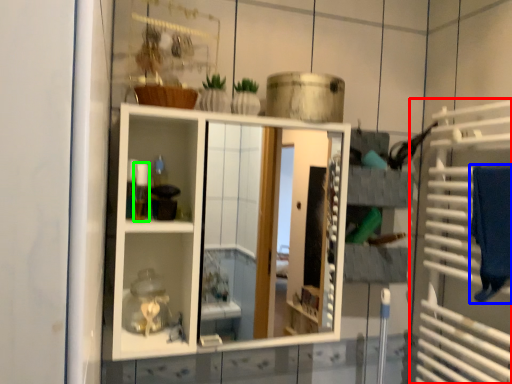
Question: Which is nearer to the cage (highlighted by a red box)? bath towel (highlighted by a blue box) or toiletry (highlighted by a green box).

Choices:
 (A) bath towel
 (B) toiletry

Answer: (A)